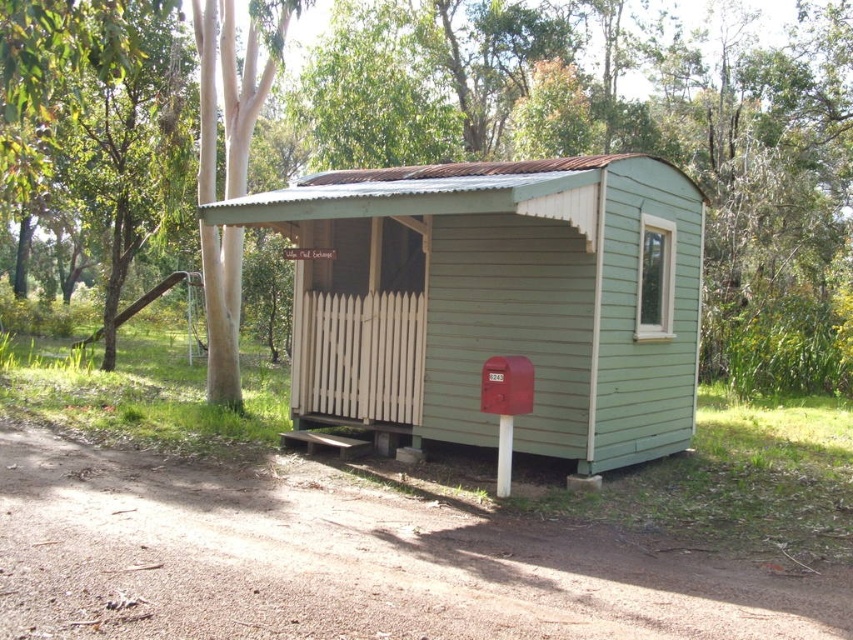
Question: Considering the real-world distances, which object is farthest from the green wood tree at center?

Choices:
 (A) green wood cabin at center
 (B) metallic red mailbox at center

Answer: (B)

Question: Is green wood tree at center further to camera compared to metallic red mailbox at center?

Choices:
 (A) no
 (B) yes

Answer: (B)

Question: Which object is the farthest from the green wood tree at center?

Choices:
 (A) green wood cabin at center
 (B) metallic red mailbox at center

Answer: (B)

Question: Is green wood tree at center below metallic red mailbox at center?

Choices:
 (A) no
 (B) yes

Answer: (A)

Question: Does green wood cabin at center have a larger size compared to metallic red mailbox at center?

Choices:
 (A) no
 (B) yes

Answer: (B)

Question: Which object is positioned closest to the green wood tree at center?

Choices:
 (A) green wood cabin at center
 (B) metallic red mailbox at center

Answer: (A)